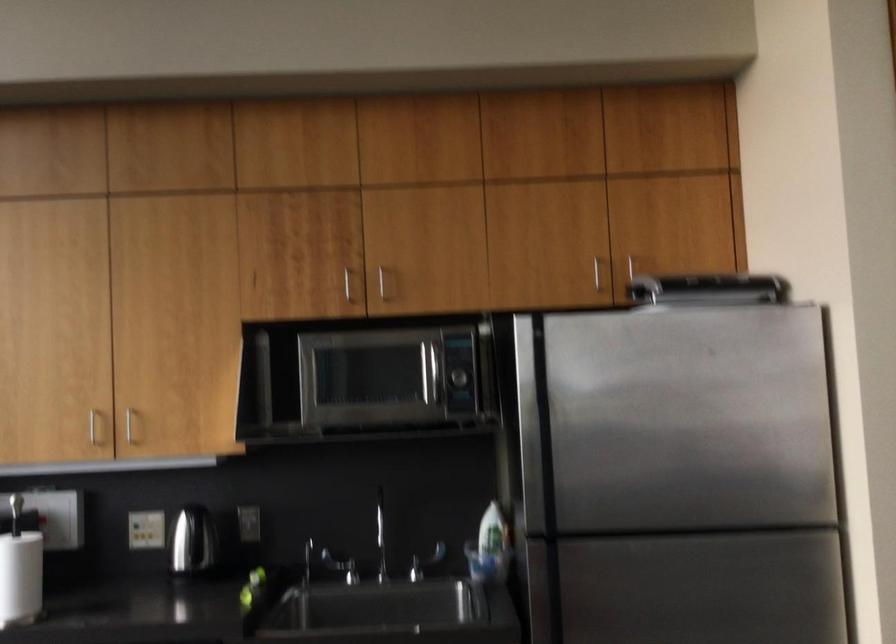
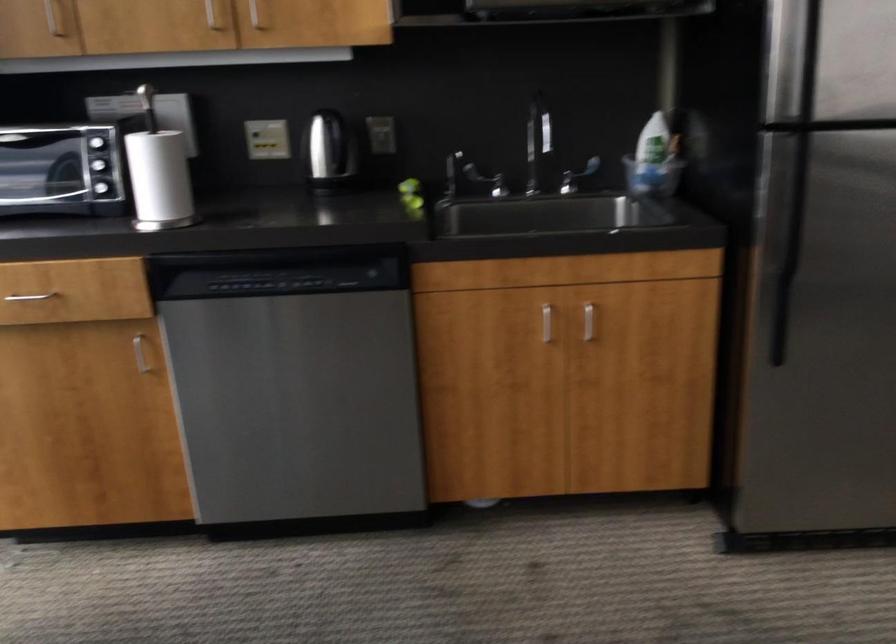
In the second image, find the point that corresponds to (424,558) in the first image.

(576, 176)